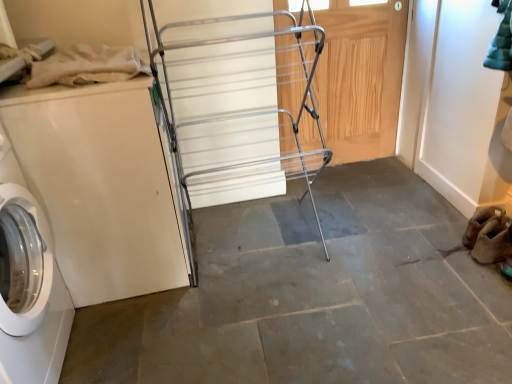
Image resolution: width=512 pixels, height=384 pixels. I want to click on free space to the right of silver metallic drying rack at center, so click(369, 240).